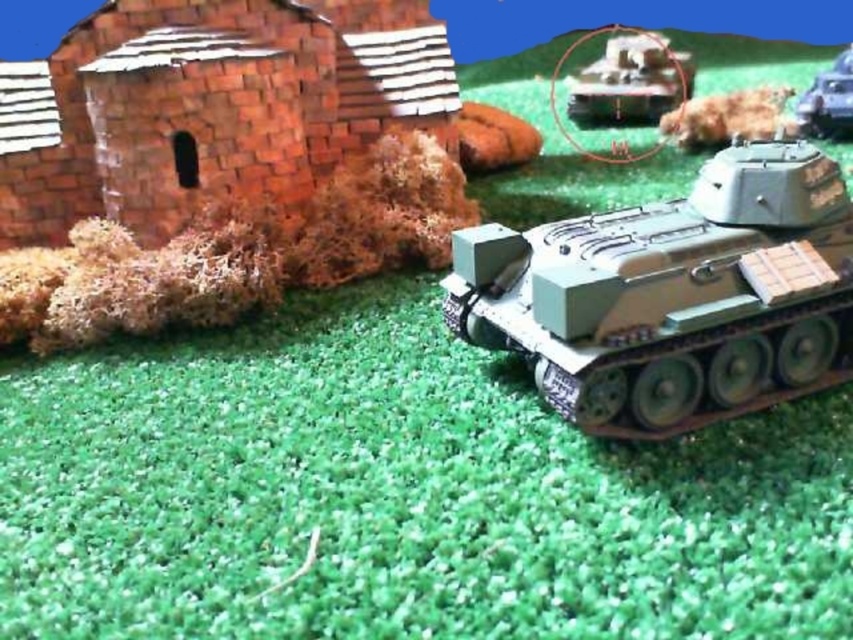
Question: Does brick textured hut at center left appear on the right side of matte gray tank at upper center?

Choices:
 (A) no
 (B) yes

Answer: (A)

Question: Is the position of camouflage plastic tank at lower right less distant than that of matte green tank at center?

Choices:
 (A) yes
 (B) no

Answer: (A)

Question: Which object appears farthest from the camera in this image?

Choices:
 (A) camouflage plastic tank at lower right
 (B) matte gray tank at upper center
 (C) brick textured hut at center left

Answer: (B)

Question: Can you confirm if brick textured hut at center left is smaller than matte green tank at center?

Choices:
 (A) yes
 (B) no

Answer: (B)

Question: Which of the following is the closest to the observer?

Choices:
 (A) (799, 108)
 (B) (654, 68)
 (C) (213, 61)
 (D) (695, 138)

Answer: (C)

Question: Which object appears farthest from the camera in this image?

Choices:
 (A) brown fur dog at upper center
 (B) brick textured hut at center left

Answer: (A)